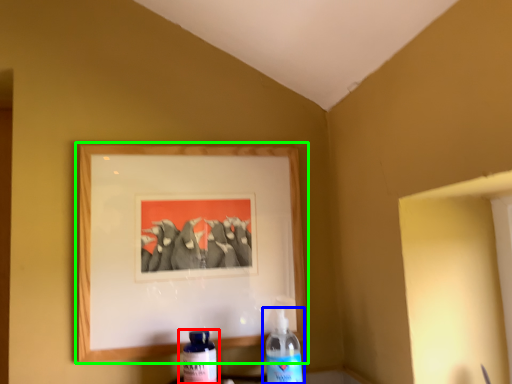
Question: Estimate the real-world distances between objects in this image. Which object is closer to bottle (highlighted by a red box), bottle (highlighted by a blue box) or picture frame (highlighted by a green box)?

Choices:
 (A) bottle
 (B) picture frame

Answer: (A)